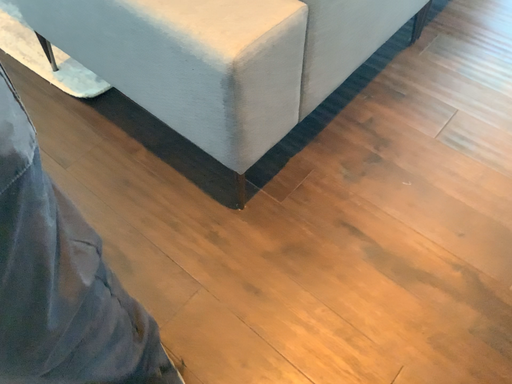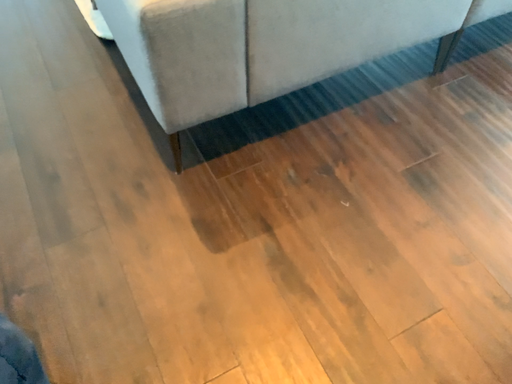
Question: How did the camera likely rotate when shooting the video?

Choices:
 (A) rotated left
 (B) rotated right

Answer: (A)